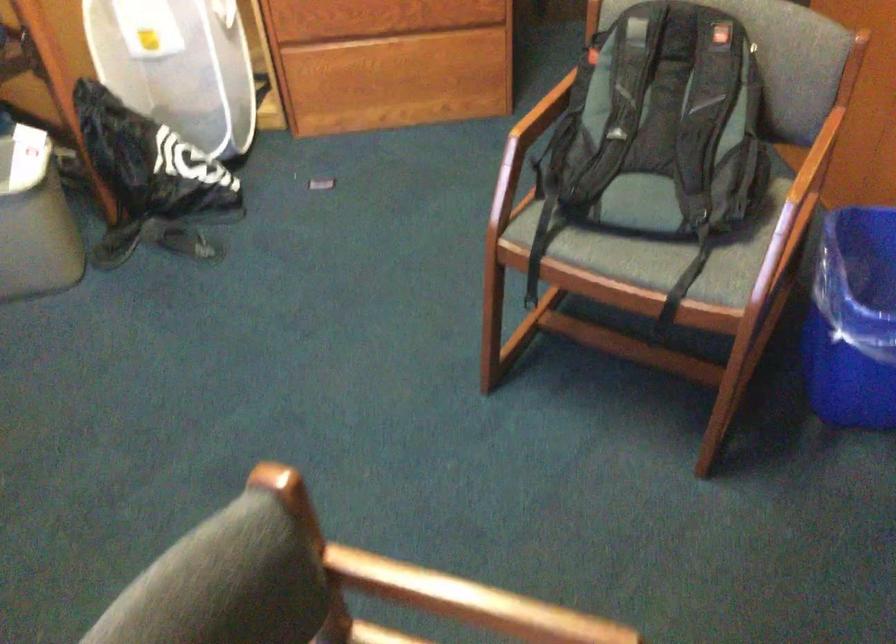
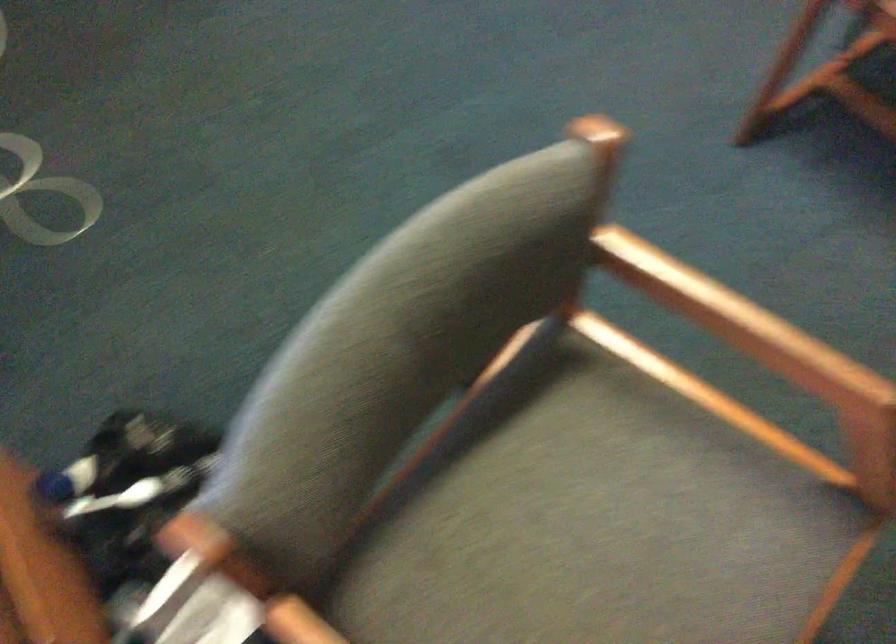
Question: The images are taken continuously from a first-person perspective. In which direction are you moving?

Choices:
 (A) Left
 (B) Right
 (C) Forward
 (D) Backward

Answer: (A)